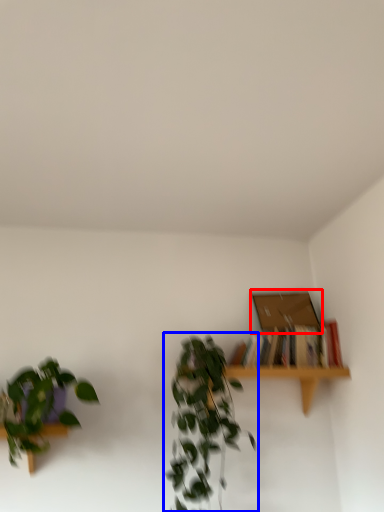
Question: Which object is further to the camera taking this photo, box (highlighted by a red box) or houseplant (highlighted by a blue box)?

Choices:
 (A) box
 (B) houseplant

Answer: (A)